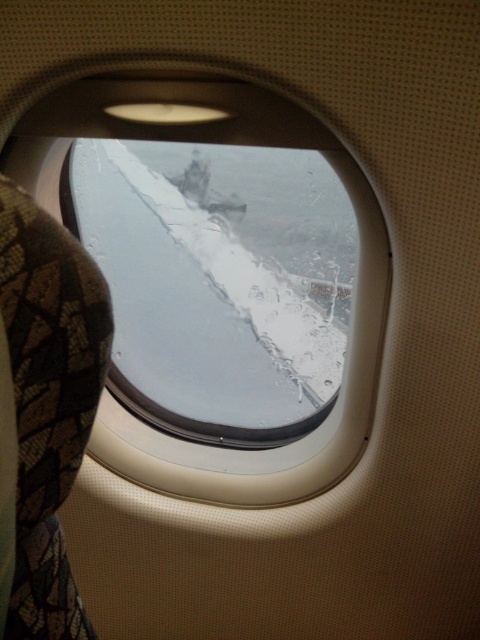
Question: Is white frosted glass at center to the right of transparent glass airplane window at center from the viewer's perspective?

Choices:
 (A) no
 (B) yes

Answer: (B)

Question: Which point is farther to the camera?

Choices:
 (A) (273, 104)
 (B) (292, 173)

Answer: (B)

Question: Which point is closer to the camera?

Choices:
 (A) transparent glass airplane window at center
 (B) white frosted glass at center

Answer: (A)

Question: Does white frosted glass at center have a smaller size compared to transparent glass airplane window at center?

Choices:
 (A) no
 (B) yes

Answer: (B)

Question: Which point is farther to the camera?

Choices:
 (A) (307, 448)
 (B) (272, 166)

Answer: (B)

Question: Can you confirm if white frosted glass at center is positioned to the left of transparent glass airplane window at center?

Choices:
 (A) no
 (B) yes

Answer: (A)